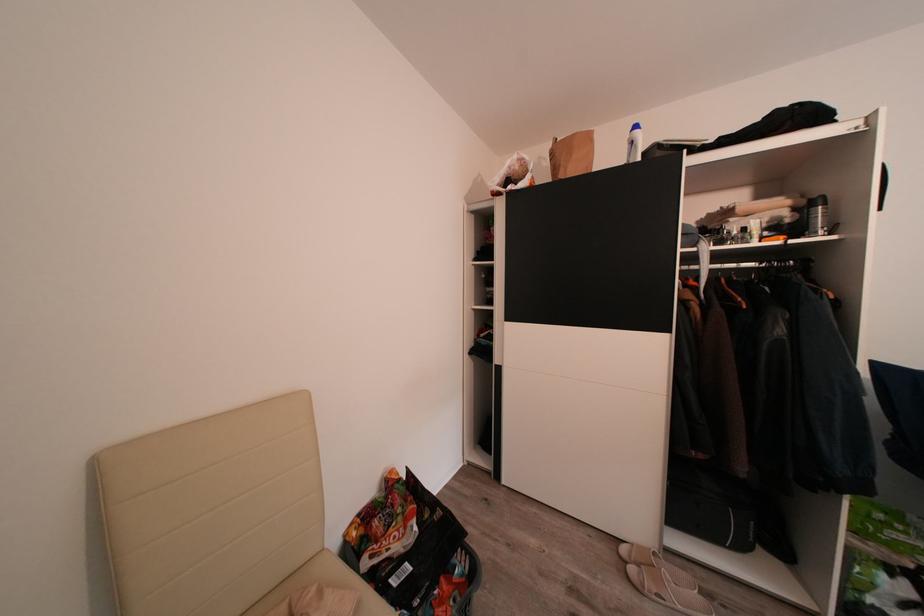
Where would you sit the chair sitting surface? Please return your answer as a coordinate pair (x, y).

(323, 586)